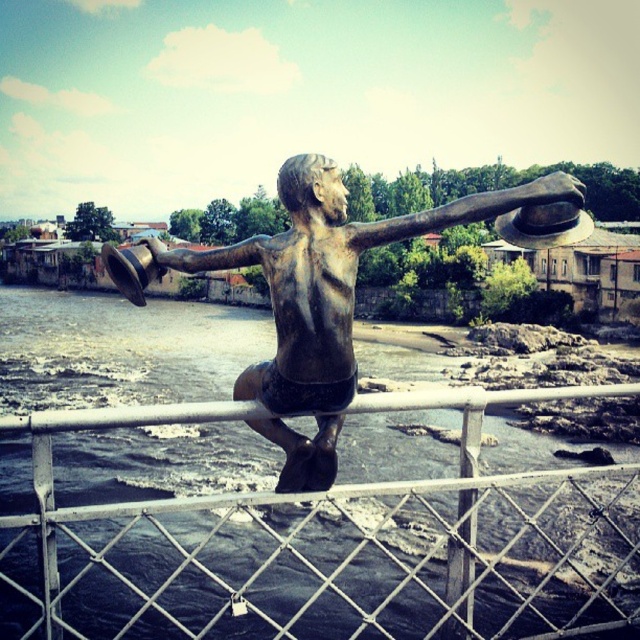
Is point (397, 529) positioned in front of point (320, 369)?

No, it is behind (320, 369).

What do you see at coordinates (328, 545) in the screenshot? I see `white metal fence at center` at bounding box center [328, 545].

Who is more distant from viewer, (x=134, y=413) or (x=337, y=385)?

Positioned behind is point (x=134, y=413).

Image resolution: width=640 pixels, height=640 pixels. Find the location of `white metal fence at center`. white metal fence at center is located at coordinates (328, 545).